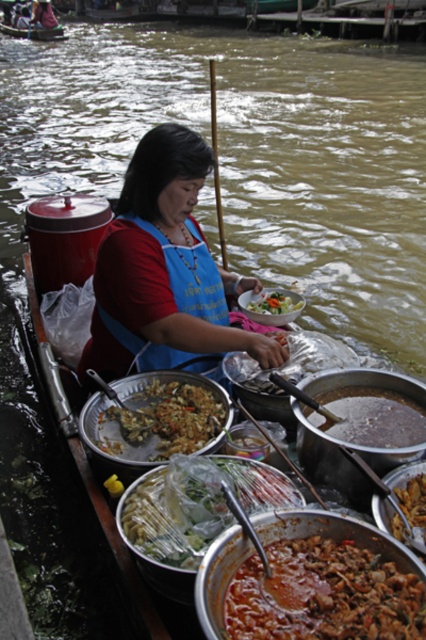
How far apart are translucent plastic bag at center and brown matte fried rice at center?

29.65 centimeters

Which is below, translucent plastic bag at center or brown matte fried rice at center?

translucent plastic bag at center is below.

Does point (250, 509) come in front of point (123, 426)?

Yes, point (250, 509) is in front of point (123, 426).

Image resolution: width=426 pixels, height=640 pixels. Identify the location of translucent plastic bag at center. (172, 520).

Between point (160, 310) and point (414, 422), which one is positioned in front?

Point (414, 422)

Is blue fabric apron at center thinner than brown matte pot at center?

No, blue fabric apron at center is not thinner than brown matte pot at center.

Describe the element at coordinates (164, 272) in the screenshot. The width and height of the screenshot is (426, 640). I see `blue fabric apron at center` at that location.

At what (x,y) coordinates should I click in order to perform the action: click on blue fabric apron at center. Please return your answer as a coordinate pair (x, y). The width and height of the screenshot is (426, 640). Looking at the image, I should click on (164, 272).

Does translucent plastic bag at center have a greater width compared to brown matte pot at center?

Yes.

Does translucent plastic bag at center appear on the right side of brown matte pot at center?

In fact, translucent plastic bag at center is to the left of brown matte pot at center.

Find the location of a particular element. This screenshot has height=640, width=426. translucent plastic bag at center is located at coordinates (172, 520).

Locate an element on the screen. The height and width of the screenshot is (640, 426). translucent plastic bag at center is located at coordinates (172, 520).